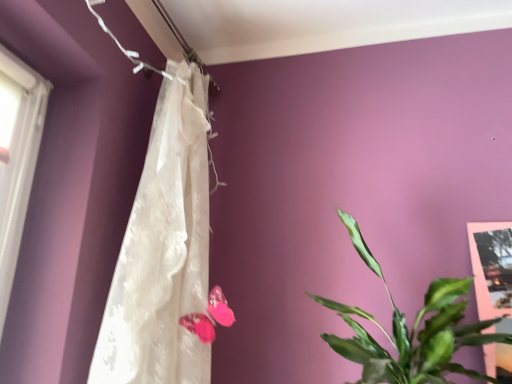
Question: Is white lace curtain at upper center closer to the viewer compared to green leafy plant at right?

Choices:
 (A) yes
 (B) no

Answer: (B)

Question: Does white lace curtain at upper center have a lesser height compared to green leafy plant at right?

Choices:
 (A) yes
 (B) no

Answer: (B)

Question: From a real-world perspective, is white lace curtain at upper center under green leafy plant at right?

Choices:
 (A) yes
 (B) no

Answer: (B)

Question: Considering the relative sizes of white lace curtain at upper center and green leafy plant at right in the image provided, is white lace curtain at upper center bigger than green leafy plant at right?

Choices:
 (A) no
 (B) yes

Answer: (B)

Question: Is white lace curtain at upper center wider than green leafy plant at right?

Choices:
 (A) yes
 (B) no

Answer: (B)

Question: Is white lace curtain at upper center positioned with its back to green leafy plant at right?

Choices:
 (A) no
 (B) yes

Answer: (A)

Question: From a real-world perspective, is pink fabric butterfly at center beneath white lace curtain at upper center?

Choices:
 (A) no
 (B) yes

Answer: (B)

Question: From the image's perspective, would you say pink fabric butterfly at center is positioned over white lace curtain at upper center?

Choices:
 (A) no
 (B) yes

Answer: (A)

Question: Is white lace curtain at upper center a part of pink fabric butterfly at center?

Choices:
 (A) no
 (B) yes

Answer: (A)

Question: Does pink fabric butterfly at center have a lesser width compared to white lace curtain at upper center?

Choices:
 (A) no
 (B) yes

Answer: (B)

Question: Can you confirm if pink fabric butterfly at center is taller than white lace curtain at upper center?

Choices:
 (A) no
 (B) yes

Answer: (A)

Question: Could you tell me if pink fabric butterfly at center is turned towards white lace curtain at upper center?

Choices:
 (A) no
 (B) yes

Answer: (B)

Question: From a real-world perspective, does pink fabric butterfly at center stand above green leafy plant at right?

Choices:
 (A) yes
 (B) no

Answer: (B)